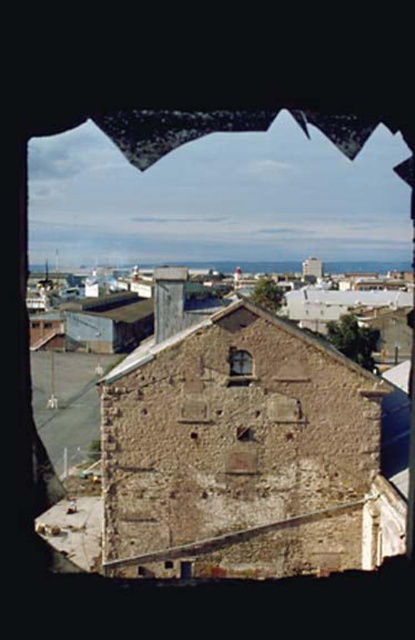
Question: Is matte glass window at center above rusty metal hole at center?

Choices:
 (A) yes
 (B) no

Answer: (A)

Question: Can you confirm if matte glass window at center is smaller than rusty metal hole at center?

Choices:
 (A) no
 (B) yes

Answer: (A)

Question: Which point appears closest to the camera in this image?

Choices:
 (A) (243, 428)
 (B) (243, 364)

Answer: (A)

Question: Can you confirm if matte glass window at center is thinner than rusty metal hole at center?

Choices:
 (A) yes
 (B) no

Answer: (B)